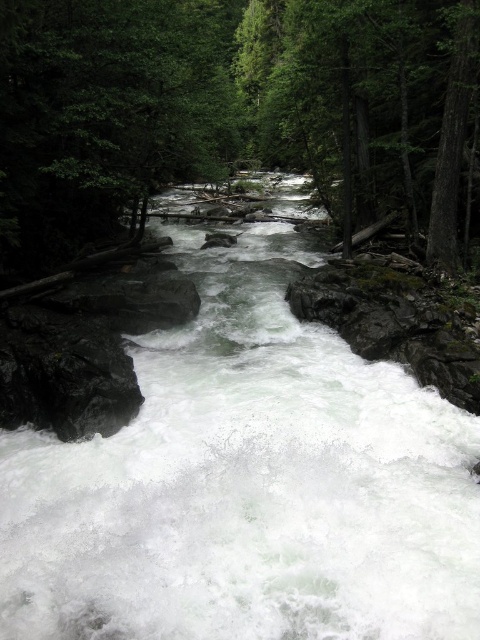
Question: Which of the following is the closest to the observer?

Choices:
 (A) green matte tree at center
 (B) white frothy water at center

Answer: (B)

Question: Is white frothy water at center above green matte tree at center?

Choices:
 (A) yes
 (B) no

Answer: (B)

Question: Is white frothy water at center bigger than green matte tree at center?

Choices:
 (A) yes
 (B) no

Answer: (B)

Question: Which point appears closest to the camera in this image?

Choices:
 (A) (94, 205)
 (B) (445, 424)

Answer: (B)

Question: Which object appears closest to the camera in this image?

Choices:
 (A) green matte tree at center
 (B) white frothy water at center

Answer: (B)

Question: In this image, where is white frothy water at center located relative to green matte tree at center?

Choices:
 (A) left
 (B) right

Answer: (B)